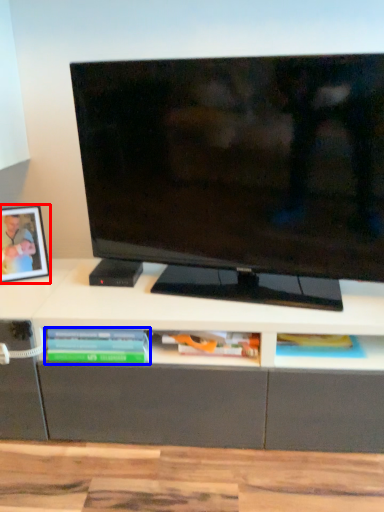
Question: Which point is closer to the camera, picture frame (highlighted by a red box) or book (highlighted by a blue box)?

Choices:
 (A) picture frame
 (B) book

Answer: (B)